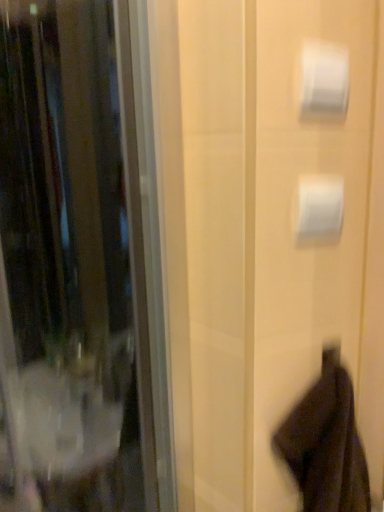
Image resolution: width=384 pixels, height=512 pixels. What do you see at coordinates (319, 207) in the screenshot?
I see `white matte toilet paper at upper right, marked as the 1th toilet paper in a bottom-to-top arrangement` at bounding box center [319, 207].

This screenshot has width=384, height=512. What are the coordinates of `dark brown fabric robe at lower right` in the screenshot? It's located at (326, 443).

Which object is closer to the camera, dark brown fabric robe at lower right or white matte toilet paper at upper right, marked as the 1th toilet paper in a bottom-to-top arrangement?

dark brown fabric robe at lower right is in front.

Is dark brown fabric robe at lower right not near white matte toilet paper at upper right, the second toilet paper viewed from the top?

dark brown fabric robe at lower right is near white matte toilet paper at upper right, the second toilet paper viewed from the top, not far away.

Is white matte toilet paper at upper right, marked as the 1th toilet paper in a bottom-to-top arrangement, at the back of dark brown fabric robe at lower right?

No, white matte toilet paper at upper right, marked as the 1th toilet paper in a bottom-to-top arrangement, is not at the back of dark brown fabric robe at lower right.

In the scene shown: Is white glossy toilet paper at upper right, the second toilet paper in the bottom-to-top sequence, far from white matte toilet paper at upper right, marked as the 1th toilet paper in a bottom-to-top arrangement?

No, white glossy toilet paper at upper right, the second toilet paper in the bottom-to-top sequence, is in close proximity to white matte toilet paper at upper right, marked as the 1th toilet paper in a bottom-to-top arrangement.

From the image's perspective, is white glossy toilet paper at upper right, which ranks as the 1th toilet paper in top-to-bottom order, under white matte toilet paper at upper right, marked as the 1th toilet paper in a bottom-to-top arrangement?

No.

Does point (300, 106) come behind point (325, 223)?

No, it is not.

Does white matte toilet paper at upper right, the second toilet paper viewed from the top, appear on the right side of dark brown fabric robe at lower right?

No, white matte toilet paper at upper right, the second toilet paper viewed from the top, is not to the right of dark brown fabric robe at lower right.

Considering the sizes of objects white matte toilet paper at upper right, the second toilet paper viewed from the top, and dark brown fabric robe at lower right in the image provided, who is thinner, white matte toilet paper at upper right, the second toilet paper viewed from the top, or dark brown fabric robe at lower right?

With smaller width is white matte toilet paper at upper right, the second toilet paper viewed from the top.

Between white matte toilet paper at upper right, marked as the 1th toilet paper in a bottom-to-top arrangement, and dark brown fabric robe at lower right, which one has less height?

white matte toilet paper at upper right, marked as the 1th toilet paper in a bottom-to-top arrangement, is shorter.

Does dark brown fabric robe at lower right appear on the left side of white glossy toilet paper at upper right, the second toilet paper in the bottom-to-top sequence?

In fact, dark brown fabric robe at lower right is to the right of white glossy toilet paper at upper right, the second toilet paper in the bottom-to-top sequence.

From a real-world perspective, which is physically above, dark brown fabric robe at lower right or white glossy toilet paper at upper right, the second toilet paper in the bottom-to-top sequence?

In real-world perspective, white glossy toilet paper at upper right, the second toilet paper in the bottom-to-top sequence, is above.

Is the surface of dark brown fabric robe at lower right in direct contact with white glossy toilet paper at upper right, which ranks as the 1th toilet paper in top-to-bottom order?

There is a gap between dark brown fabric robe at lower right and white glossy toilet paper at upper right, which ranks as the 1th toilet paper in top-to-bottom order.

Is dark brown fabric robe at lower right inside the boundaries of white glossy toilet paper at upper right, which ranks as the 1th toilet paper in top-to-bottom order, or outside?

dark brown fabric robe at lower right exists outside the volume of white glossy toilet paper at upper right, which ranks as the 1th toilet paper in top-to-bottom order.

Can you tell me how much white glossy toilet paper at upper right, which ranks as the 1th toilet paper in top-to-bottom order, and dark brown fabric robe at lower right differ in facing direction?

white glossy toilet paper at upper right, which ranks as the 1th toilet paper in top-to-bottom order, and dark brown fabric robe at lower right are facing 19 degrees away from each other.

Based on the photo, are white glossy toilet paper at upper right, the second toilet paper in the bottom-to-top sequence, and dark brown fabric robe at lower right located far from each other?

white glossy toilet paper at upper right, the second toilet paper in the bottom-to-top sequence, is actually quite close to dark brown fabric robe at lower right.

Relative to dark brown fabric robe at lower right, is white glossy toilet paper at upper right, which ranks as the 1th toilet paper in top-to-bottom order, in front or behind?

Visually, white glossy toilet paper at upper right, which ranks as the 1th toilet paper in top-to-bottom order, is located behind dark brown fabric robe at lower right.

Find the location of a particular element. This screenshot has height=512, width=384. robe that appears below the white glossy toilet paper at upper right, the second toilet paper in the bottom-to-top sequence (from a real-world perspective) is located at coordinates (326, 443).

Can you confirm if white matte toilet paper at upper right, the second toilet paper viewed from the top, is shorter than white glossy toilet paper at upper right, the second toilet paper in the bottom-to-top sequence?

Incorrect, the height of white matte toilet paper at upper right, the second toilet paper viewed from the top, does not fall short of that of white glossy toilet paper at upper right, the second toilet paper in the bottom-to-top sequence.

Can white glossy toilet paper at upper right, which ranks as the 1th toilet paper in top-to-bottom order, be found inside white matte toilet paper at upper right, marked as the 1th toilet paper in a bottom-to-top arrangement?

That's incorrect, white glossy toilet paper at upper right, which ranks as the 1th toilet paper in top-to-bottom order, is not inside white matte toilet paper at upper right, marked as the 1th toilet paper in a bottom-to-top arrangement.

How different are the orientations of white matte toilet paper at upper right, the second toilet paper viewed from the top, and white glossy toilet paper at upper right, the second toilet paper in the bottom-to-top sequence, in degrees?

0 degrees.

In the image, is white matte toilet paper at upper right, marked as the 1th toilet paper in a bottom-to-top arrangement, on the left side or the right side of white glossy toilet paper at upper right, which ranks as the 1th toilet paper in top-to-bottom order?

From the image, it's evident that white matte toilet paper at upper right, marked as the 1th toilet paper in a bottom-to-top arrangement, is to the right of white glossy toilet paper at upper right, which ranks as the 1th toilet paper in top-to-bottom order.

Where is `robe in front of the white matte toilet paper at upper right, marked as the 1th toilet paper in a bottom-to-top arrangement`? The image size is (384, 512). robe in front of the white matte toilet paper at upper right, marked as the 1th toilet paper in a bottom-to-top arrangement is located at coordinates (326, 443).

I want to click on toilet paper on the left side of white matte toilet paper at upper right, the second toilet paper viewed from the top, so click(x=323, y=80).

Estimate the real-world distances between objects in this image. Which object is closer to dark brown fabric robe at lower right, white matte toilet paper at upper right, marked as the 1th toilet paper in a bottom-to-top arrangement, or white glossy toilet paper at upper right, the second toilet paper in the bottom-to-top sequence?

white matte toilet paper at upper right, marked as the 1th toilet paper in a bottom-to-top arrangement, is closer to dark brown fabric robe at lower right.

Based on their spatial positions, is dark brown fabric robe at lower right or white glossy toilet paper at upper right, which ranks as the 1th toilet paper in top-to-bottom order, closer to white matte toilet paper at upper right, marked as the 1th toilet paper in a bottom-to-top arrangement?

white glossy toilet paper at upper right, which ranks as the 1th toilet paper in top-to-bottom order, is positioned closer to the anchor white matte toilet paper at upper right, marked as the 1th toilet paper in a bottom-to-top arrangement.

Based on their spatial positions, is white glossy toilet paper at upper right, which ranks as the 1th toilet paper in top-to-bottom order, or dark brown fabric robe at lower right further from white matte toilet paper at upper right, the second toilet paper viewed from the top?

dark brown fabric robe at lower right lies further to white matte toilet paper at upper right, the second toilet paper viewed from the top, than the other object.

Which object lies further to the anchor point white glossy toilet paper at upper right, which ranks as the 1th toilet paper in top-to-bottom order, dark brown fabric robe at lower right or white matte toilet paper at upper right, the second toilet paper viewed from the top?

dark brown fabric robe at lower right lies further to white glossy toilet paper at upper right, which ranks as the 1th toilet paper in top-to-bottom order, than the other object.

Estimate the real-world distances between objects in this image. Which object is further from dark brown fabric robe at lower right, white glossy toilet paper at upper right, the second toilet paper in the bottom-to-top sequence, or white matte toilet paper at upper right, the second toilet paper viewed from the top?

The object further to dark brown fabric robe at lower right is white glossy toilet paper at upper right, the second toilet paper in the bottom-to-top sequence.

Which object lies further to the anchor point white glossy toilet paper at upper right, the second toilet paper in the bottom-to-top sequence, white matte toilet paper at upper right, the second toilet paper viewed from the top, or dark brown fabric robe at lower right?

dark brown fabric robe at lower right is positioned further to the anchor white glossy toilet paper at upper right, the second toilet paper in the bottom-to-top sequence.

Locate an element on the screen. Image resolution: width=384 pixels, height=512 pixels. toilet paper between white glossy toilet paper at upper right, which ranks as the 1th toilet paper in top-to-bottom order, and dark brown fabric robe at lower right in the up-down direction is located at coordinates (319, 207).